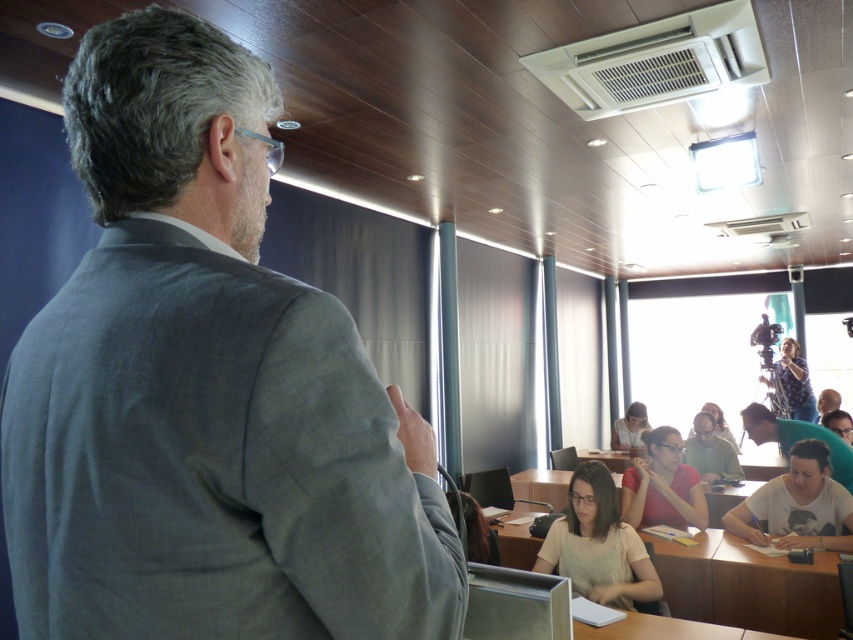
Question: Which object is farther from the camera taking this photo?

Choices:
 (A) matte red shirt at center
 (B) gray linen suit at upper left
 (C) white matte shirt at lower right

Answer: (A)

Question: Among these objects, which one is farthest from the camera?

Choices:
 (A) light brown hair at lower right
 (B) gray linen suit at upper left
 (C) matte gray shirt at center

Answer: (C)

Question: Which point is closer to the camera?

Choices:
 (A) (177, 236)
 (B) (842, 477)

Answer: (A)

Question: Does white matte shirt at lower right have a greater width compared to light brown hair at lower right?

Choices:
 (A) yes
 (B) no

Answer: (A)

Question: Is the position of light brown hair at lower right less distant than that of matte gray shirt at center?

Choices:
 (A) yes
 (B) no

Answer: (A)

Question: Is gray linen suit at upper left bigger than matte red shirt at center?

Choices:
 (A) no
 (B) yes

Answer: (A)